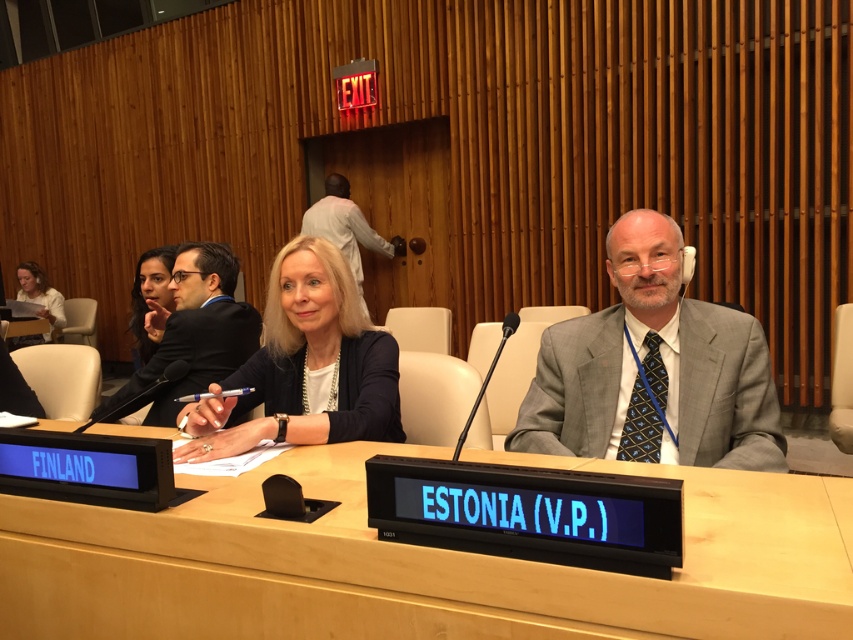
Is point (755, 468) positioned after point (137, 337)?

No.

Between point (730, 456) and point (169, 262), which one is positioned behind?

The point (169, 262) is more distant.

Where is `gray suit at center`? gray suit at center is located at coordinates (653, 369).

Does matte black blazer at center appear under light brown wood door at upper center?

Yes, matte black blazer at center is below light brown wood door at upper center.

Does matte black blazer at center have a greater height compared to light brown wood door at upper center?

No, matte black blazer at center is not taller than light brown wood door at upper center.

What do you see at coordinates (305, 365) in the screenshot? The image size is (853, 640). I see `matte black blazer at center` at bounding box center [305, 365].

I want to click on matte black blazer at center, so click(x=305, y=365).

Is point (192, 448) more distant than point (132, 300)?

No, it is not.

Based on the photo, can you confirm if matte black blazer at center is shorter than matte black hair at upper left?

No, matte black blazer at center is not shorter than matte black hair at upper left.

Does point (379, 337) come behind point (155, 296)?

No, it is not.

This screenshot has width=853, height=640. Identify the location of matte black blazer at center. pyautogui.click(x=305, y=365).